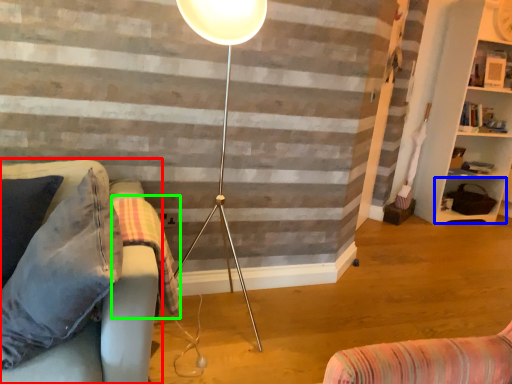
Question: Which object is the closest to the studio couch (highlighted by a red box)? Choose among these: shelf (highlighted by a blue box) or blanket (highlighted by a green box).

Choices:
 (A) shelf
 (B) blanket

Answer: (B)